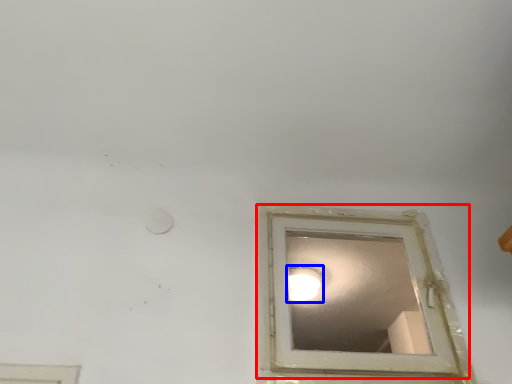
Question: Among these objects, which one is farthest to the camera, window (highlighted by a red box) or lighting (highlighted by a blue box)?

Choices:
 (A) window
 (B) lighting

Answer: (B)